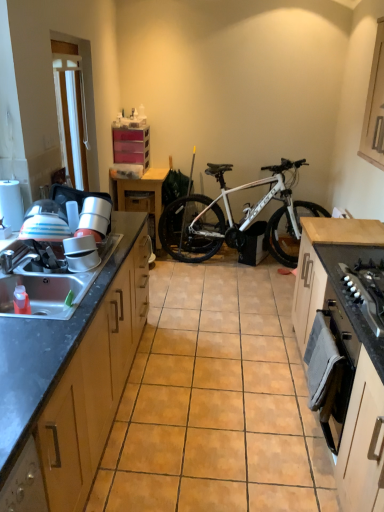
Image resolution: width=384 pixels, height=512 pixels. What do you see at coordinates (70, 381) in the screenshot? I see `matte black sink at left, acting as the 5th cabinetry starting from the right` at bounding box center [70, 381].

How much space does matte black sink at left, which appears as the first cabinetry when viewed from the left, occupy horizontally?

Result: It is 25.35 inches.

Identify the location of wooden drawer at center. This screenshot has width=384, height=512. (140, 201).

What are the coordinates of `silver metallic sink at left` in the screenshot? It's located at (45, 292).

From the image's perspective, is matte black sink at left, acting as the 5th cabinetry starting from the right, above or below wooden table at center?

From the image's perspective, matte black sink at left, acting as the 5th cabinetry starting from the right, appears below wooden table at center.

Is matte black sink at left, which appears as the first cabinetry when viewed from the left, with wooden table at center?

matte black sink at left, which appears as the first cabinetry when viewed from the left, and wooden table at center are not in contact.

Between matte black sink at left, acting as the 5th cabinetry starting from the right, and wooden table at center, which one has larger size?

Bigger between the two is matte black sink at left, acting as the 5th cabinetry starting from the right.

Which point is more forward, (86, 309) or (154, 247)?

The point (86, 309) is in front.

Which object is further away from the camera taking this photo, brushed metal faucet at sink left or matte black sink at left, which appears as the first cabinetry when viewed from the left?

brushed metal faucet at sink left is behind.

Which object is wider, brushed metal faucet at sink left or matte black sink at left, which appears as the first cabinetry when viewed from the left?

With larger width is matte black sink at left, which appears as the first cabinetry when viewed from the left.

From a real-world perspective, which object stands above the other?

brushed metal faucet at sink left is physically above.

How many degrees apart are the facing directions of brushed metal faucet at sink left and matte black sink at left, acting as the 5th cabinetry starting from the right?

A: 28.4 degrees separate the facing orientations of brushed metal faucet at sink left and matte black sink at left, acting as the 5th cabinetry starting from the right.

Consider the image. From a real-world perspective, is black matte gas stove at right physically below wooden cabinet at upper right, the 5th cabinetry in the left-to-right sequence?

Yes.

Are black matte gas stove at right and wooden cabinet at upper right, the 5th cabinetry in the left-to-right sequence, located far from each other?

Absolutely, black matte gas stove at right is distant from wooden cabinet at upper right, the 5th cabinetry in the left-to-right sequence.

Looking at their sizes, would you say black matte gas stove at right is wider or thinner than wooden cabinet at upper right, the 5th cabinetry in the left-to-right sequence?

Clearly, black matte gas stove at right has more width compared to wooden cabinet at upper right, the 5th cabinetry in the left-to-right sequence.

What's the angular difference between matte white bowl at sink, positioned as the second appliance in top-to-bottom order, and translucent plastic drawers at upper center, arranged as the fourth cabinetry when viewed from the right,'s facing directions?

93.3 degrees.

Which appliance is the 2nd one when counting from the front of the translucent plastic drawers at upper center, arranged as the fourth cabinetry when viewed from the right? Please provide its 2D coordinates.

[(81, 253)]

Looking at this image, in terms of width, does matte white bowl at sink, positioned as the second appliance in top-to-bottom order, look wider or thinner when compared to translucent plastic drawers at upper center, the 2th cabinetry from the left?

In the image, matte white bowl at sink, positioned as the second appliance in top-to-bottom order, appears to be more narrow than translucent plastic drawers at upper center, the 2th cabinetry from the left.

How distant is matte white bowl at sink, which is the 1th appliance in bottom-to-top order, from translucent plastic drawers at upper center, arranged as the fourth cabinetry when viewed from the right?

matte white bowl at sink, which is the 1th appliance in bottom-to-top order, and translucent plastic drawers at upper center, arranged as the fourth cabinetry when viewed from the right, are 2.24 meters apart from each other.

Is metallic silver bowl at left, placed as the second appliance when sorted from front to back, beside white plastic window screen at upper left?

metallic silver bowl at left, placed as the second appliance when sorted from front to back, and white plastic window screen at upper left are clearly separated.

Considering the sizes of objects metallic silver bowl at left, acting as the second appliance starting from the bottom, and white plastic window screen at upper left in the image provided, who is taller, metallic silver bowl at left, acting as the second appliance starting from the bottom, or white plastic window screen at upper left?

white plastic window screen at upper left is taller.

Is white plastic window screen at upper left inside metallic silver bowl at left, the 1th appliance when ordered from top to bottom?

No, white plastic window screen at upper left is located outside of metallic silver bowl at left, the 1th appliance when ordered from top to bottom.

From the image's perspective, is metallic silver bowl at left, which is the first appliance from back to front, positioned above or below white plastic window screen at upper left?

metallic silver bowl at left, which is the first appliance from back to front, is situated lower than white plastic window screen at upper left in the image.

Is wooden drawer at center bigger or smaller than wooden cabinet at lower right, arranged as the third cabinetry when viewed from the left?

Clearly, wooden drawer at center is smaller in size than wooden cabinet at lower right, arranged as the third cabinetry when viewed from the left.

What's the angular difference between wooden drawer at center and wooden cabinet at lower right, arranged as the third cabinetry when viewed from the left,'s facing directions?

There is a 90.4-degree angle between the facing directions of wooden drawer at center and wooden cabinet at lower right, arranged as the third cabinetry when viewed from the left.

Locate an element on the screen. This screenshot has height=512, width=384. drawer behind the wooden cabinet at lower right, arranged as the 3th cabinetry when viewed from the right is located at coordinates (140, 201).

Can you confirm if wooden drawer at center is thinner than wooden cabinet at lower right, arranged as the 3th cabinetry when viewed from the right?

In fact, wooden drawer at center might be wider than wooden cabinet at lower right, arranged as the 3th cabinetry when viewed from the right.

From the image's perspective, which is above, white metallic bicycle at center or brushed metal faucet at sink left?

white metallic bicycle at center, from the image's perspective.

In order to click on faucet located on the left of white metallic bicycle at center in this screenshot , I will do `click(16, 256)`.

Is white metallic bicycle at center not inside brushed metal faucet at sink left?

Indeed, white metallic bicycle at center is completely outside brushed metal faucet at sink left.

Considering the sizes of white metallic bicycle at center and brushed metal faucet at sink left in the image, is white metallic bicycle at center bigger or smaller than brushed metal faucet at sink left?

white metallic bicycle at center is bigger than brushed metal faucet at sink left.

Identify the location of cabinetry that is the 3rd one when counting forward from the wooden table at center. (70, 381).

There is a brushed metal faucet at sink left. Where is `the 1st cabinetry below it (from the image's perspective)`? Image resolution: width=384 pixels, height=512 pixels. the 1st cabinetry below it (from the image's perspective) is located at coordinates (70, 381).

From the image, which object appears to be farther from metallic silver bowl at left, acting as the second appliance starting from the bottom, black matte gas stove at right or wooden cabinet at lower right, arranged as the 3th cabinetry when viewed from the right?

wooden cabinet at lower right, arranged as the 3th cabinetry when viewed from the right, is positioned further to the anchor metallic silver bowl at left, acting as the second appliance starting from the bottom.

When comparing their distances from brushed metal faucet at sink left, does white matte oven at right, placed as the 2th cabinetry when sorted from right to left, or wooden cabinet at lower right, arranged as the third cabinetry when viewed from the left, seem further?

wooden cabinet at lower right, arranged as the third cabinetry when viewed from the left.

Based on the photo, estimate the real-world distances between objects in this image. Which object is further from black matte gas stove at right, white metallic bicycle at center or matte black sink at left, acting as the 5th cabinetry starting from the right?

Among the two, white metallic bicycle at center is located further to black matte gas stove at right.

Based on their spatial positions, is wooden cabinet at lower right, arranged as the third cabinetry when viewed from the left, or white plastic window screen at upper left closer to metallic silver bowl at left, which is the first appliance from back to front?

white plastic window screen at upper left is closer to metallic silver bowl at left, which is the first appliance from back to front.

Based on their spatial positions, is matte white bowl at sink, the second appliance in the back-to-front sequence, or white plastic window screen at upper left closer to matte black sink at left, which appears as the first cabinetry when viewed from the left?

The object closer to matte black sink at left, which appears as the first cabinetry when viewed from the left, is matte white bowl at sink, the second appliance in the back-to-front sequence.

Estimate the real-world distances between objects in this image. Which object is further from matte white bowl at sink, the 1th appliance from the front, black matte gas stove at right or brushed metal faucet at sink left?

black matte gas stove at right.

From the picture: When comparing their distances from white metallic bicycle at center, does wooden cabinet at lower right, arranged as the third cabinetry when viewed from the left, or silver metallic sink at left seem further?

The object further to white metallic bicycle at center is wooden cabinet at lower right, arranged as the third cabinetry when viewed from the left.

Considering their positions, is wooden cabinet at lower right, arranged as the third cabinetry when viewed from the left, positioned further to wooden cabinet at upper right, arranged as the first cabinetry when viewed from the right, than white metallic bicycle at center?

Based on the image, wooden cabinet at lower right, arranged as the third cabinetry when viewed from the left, appears to be further to wooden cabinet at upper right, arranged as the first cabinetry when viewed from the right.

At what (x,y) coordinates should I click in order to perform the action: click on table located between brushed metal faucet at sink left and translucent plastic drawers at upper center, arranged as the fourth cabinetry when viewed from the right, in the depth direction. Please return your answer as a coordinate pair (x, y). This screenshot has height=512, width=384. Looking at the image, I should click on (141, 197).

Where is `table between white matte oven at right, acting as the fourth cabinetry starting from the left, and wooden drawer at center in the front-back direction`? The width and height of the screenshot is (384, 512). table between white matte oven at right, acting as the fourth cabinetry starting from the left, and wooden drawer at center in the front-back direction is located at coordinates (141, 197).

This screenshot has height=512, width=384. In order to click on sink positioned between black matte gas stove at right and white metallic bicycle at center from near to far in this screenshot , I will do `click(45, 292)`.

Find the location of a particular element. This screenshot has width=384, height=512. bicycle between metallic silver bowl at left, the 1th appliance when ordered from top to bottom, and translucent plastic drawers at upper center, the 2th cabinetry from the left, in the front-back direction is located at coordinates (233, 219).